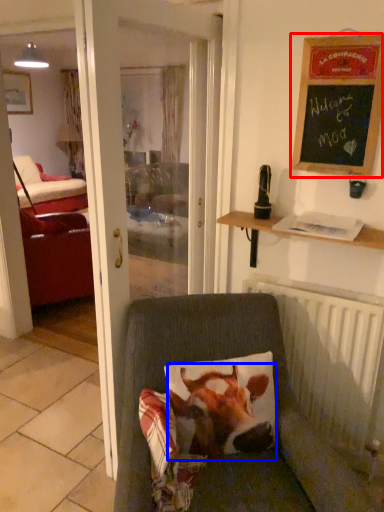
Question: Which of the following is the farthest to the observer, bulletin board (highlighted by a red box) or cattle (highlighted by a blue box)?

Choices:
 (A) bulletin board
 (B) cattle

Answer: (A)